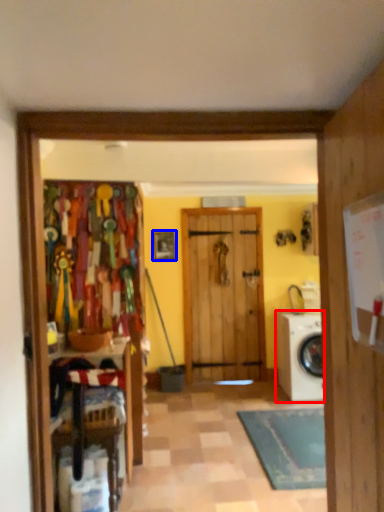
Question: Which object is closer to the camera taking this photo, washing machine (highlighted by a red box) or picture frame (highlighted by a blue box)?

Choices:
 (A) washing machine
 (B) picture frame

Answer: (A)